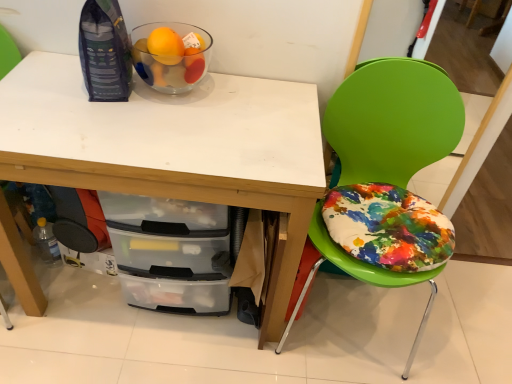
Locate an element on the screen. free space above white matte desk at upper center (from a real-world perspective) is located at coordinates (158, 114).